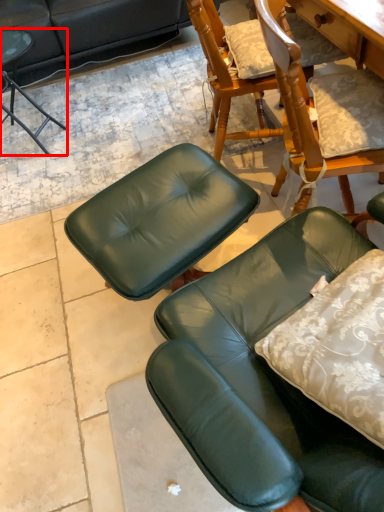
Question: Considering the relative positions of chair (annotated by the red box) and chair in the image provided, where is chair (annotated by the red box) located with respect to the staircase?

Choices:
 (A) left
 (B) right

Answer: (A)